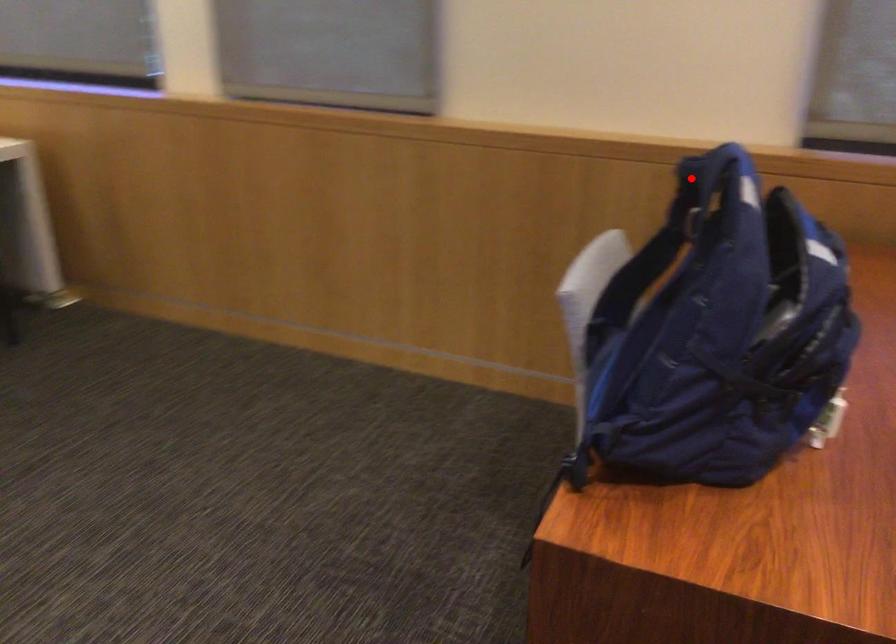
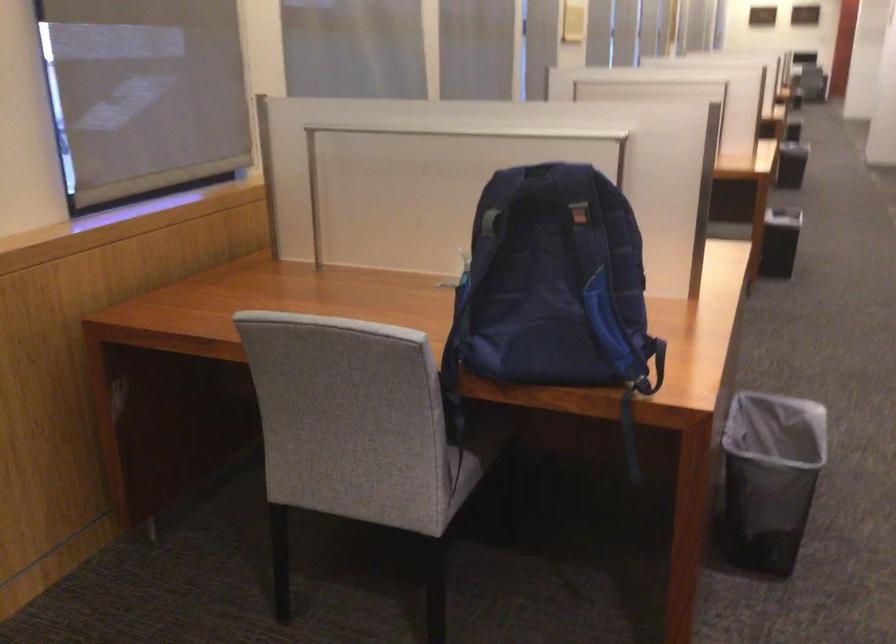
Where in the second image is the point corresponding to the highlighted location from the first image?

(538, 184)